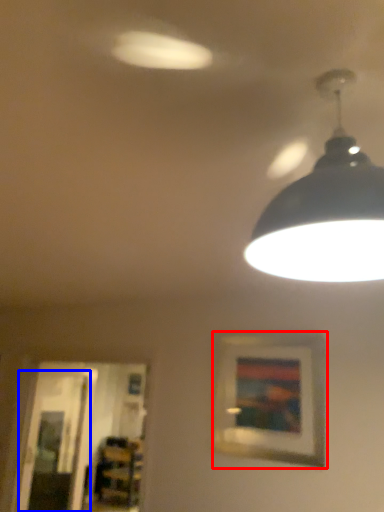
Question: Among these objects, which one is nearest to the camera, picture frame (highlighted by a red box) or glass door (highlighted by a blue box)?

Choices:
 (A) picture frame
 (B) glass door

Answer: (A)